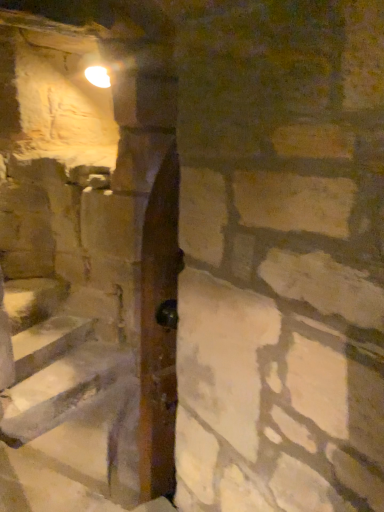
Identify the location of wooden at left. (64, 365).

The width and height of the screenshot is (384, 512). What do you see at coordinates (64, 365) in the screenshot?
I see `wooden at left` at bounding box center [64, 365].

Find the location of a particular element. The image size is (384, 512). wooden at left is located at coordinates (64, 365).